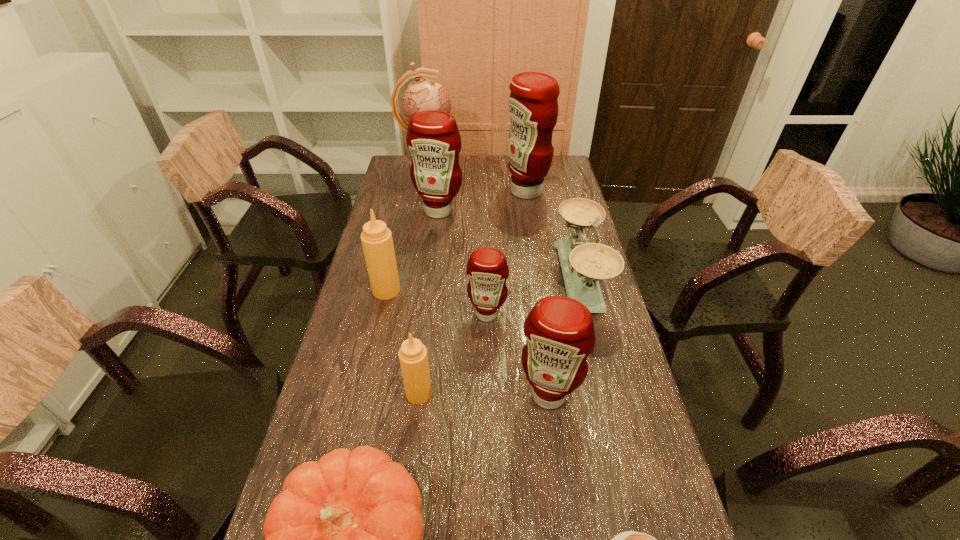
Locate an element on the screen. This screenshot has width=960, height=540. the tallest condiment is located at coordinates (533, 106).

Find the location of `the farthest object`. the farthest object is located at coordinates (424, 94).

The width and height of the screenshot is (960, 540). Identify the location of globe. (424, 94).

This screenshot has height=540, width=960. What are the coordinates of `the leftmost red condiment` in the screenshot? It's located at (433, 138).

The image size is (960, 540). Find the location of `the eighth shortest object`. the eighth shortest object is located at coordinates [x=433, y=138].

Identify the location of the farther tan condiment. pyautogui.click(x=376, y=238).

You are a GUI agent. You are given a task and a screenshot of the screen. Output one action in this format:
    pyautogui.click(x=<x>, y=<y>)
    Task: Click on the third farthest condiment
    
    Given the screenshot: What is the action you would take?
    pyautogui.click(x=376, y=238)

I want to click on the third biggest red condiment, so 560,334.

Where is `scale`? scale is located at coordinates (583, 264).

Where is `the right tan condiment`? the right tan condiment is located at coordinates (413, 357).